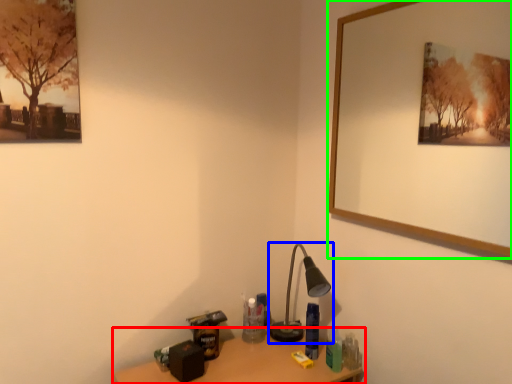
Question: Based on their relative distances, which object is farther from table (highlighted by a red box)? Choose from lamp (highlighted by a blue box) and picture frame (highlighted by a green box).

Choices:
 (A) lamp
 (B) picture frame

Answer: (B)